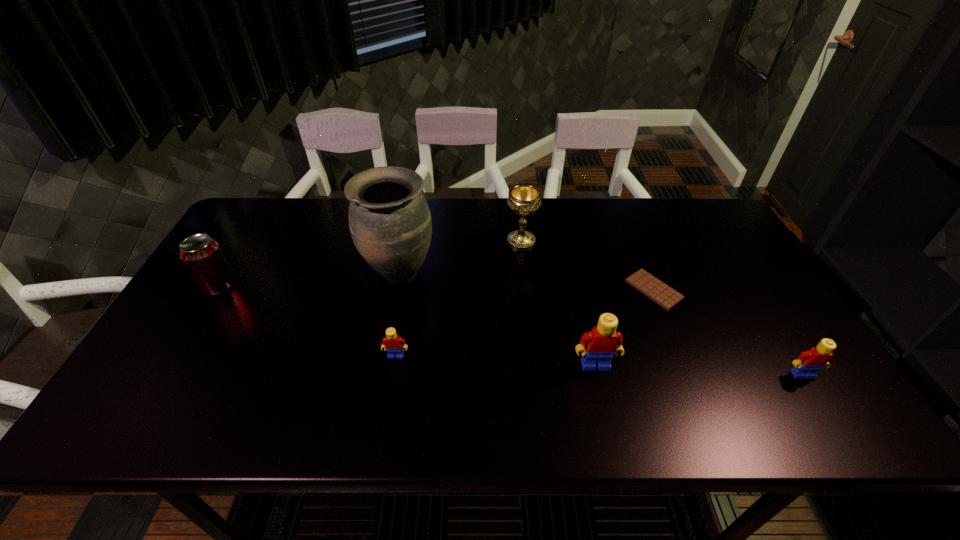
You are a GUI agent. You are given a task and a screenshot of the screen. Output one action in this format:
    pyautogui.click(x=<x>, y=<y>)
    Task: Click on the vacant area at the far edge of the desktop
    
    Given the screenshot: What is the action you would take?
    pyautogui.click(x=618, y=200)

Locate an element on the screen. This screenshot has height=540, width=960. free region at the near edge is located at coordinates (225, 377).

You are a GUI agent. You are given a task and a screenshot of the screen. Output one action in this format:
    pyautogui.click(x=<x>, y=<y>)
    Task: Click on the vacant space at the left edge of the desktop
    The image size is (960, 540).
    Given the screenshot: What is the action you would take?
    pyautogui.click(x=188, y=306)

The width and height of the screenshot is (960, 540). In the image, there is a desktop. Find the location of `vacant space at the right edge`. vacant space at the right edge is located at coordinates (776, 331).

This screenshot has height=540, width=960. In order to click on free space between the candy bar and the urn in this screenshot , I will do `click(527, 281)`.

The width and height of the screenshot is (960, 540). I want to click on unoccupied area between the soda can and the shortest Lego, so click(307, 320).

Where is `vacant space that is in between the urn and the leftmost Lego`? The width and height of the screenshot is (960, 540). vacant space that is in between the urn and the leftmost Lego is located at coordinates (397, 314).

The height and width of the screenshot is (540, 960). Find the location of `free space between the fourth object from right to left and the sixth tallest object`. free space between the fourth object from right to left and the sixth tallest object is located at coordinates (459, 299).

In order to click on empty location between the tallest Lego and the shortest object in this screenshot , I will do `click(625, 327)`.

Identify the location of empty space that is in between the second Lego from left to right and the urn. This screenshot has height=540, width=960. (497, 319).